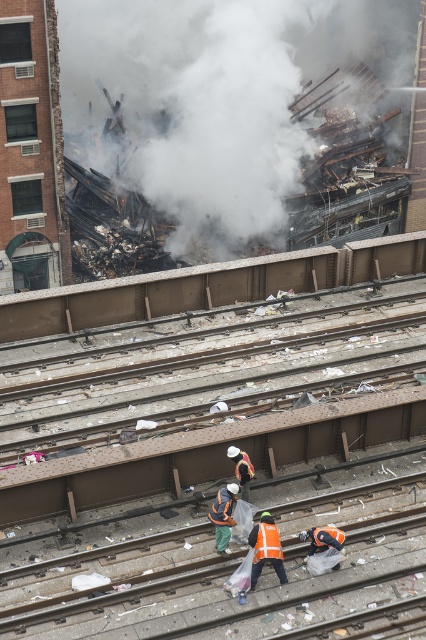
From the picture: Does reflective orange vest at center have a lesser width compared to orange reflective safety vest at lower center?

No.

Which of these two, reflective orange vest at center or orange reflective safety vest at lower center, stands shorter?

Standing shorter between the two is orange reflective safety vest at lower center.

Find the location of `reflective orange vest at center`. reflective orange vest at center is located at coordinates (265, 548).

What are the coordinates of `reflective orange vest at center` in the screenshot? It's located at (265, 548).

Can you confirm if white smoke at upper center is bigger than orange reflective safety vest at lower center?

Correct, white smoke at upper center is larger in size than orange reflective safety vest at lower center.

Can you confirm if white smoke at upper center is shorter than orange reflective safety vest at lower center?

No, white smoke at upper center is not shorter than orange reflective safety vest at lower center.

Is point (201, 147) farther from viewer compared to point (270, 552)?

Yes, point (201, 147) is farther from viewer.

In order to click on white smoke at upper center in this screenshot , I will do `click(218, 93)`.

Where is `white smoke at upper center`? white smoke at upper center is located at coordinates pos(218,93).

Where is `white smoke at upper center`? The width and height of the screenshot is (426, 640). white smoke at upper center is located at coordinates (218, 93).